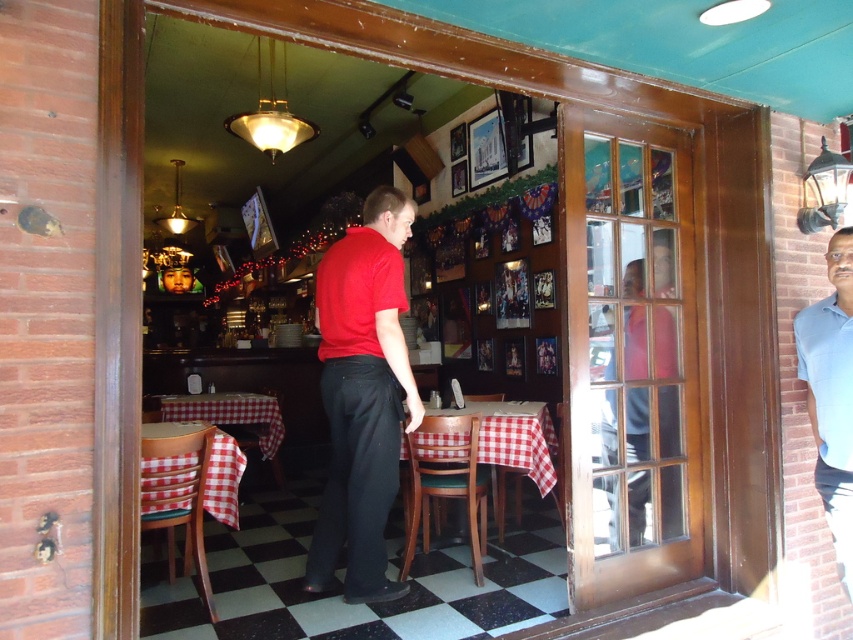
Question: Can you confirm if red matte shirt at center is wider than red checkered fabric at lower left?

Choices:
 (A) no
 (B) yes

Answer: (A)

Question: Does light blue cotton shirt at right appear on the right side of checkered fabric table at center?

Choices:
 (A) no
 (B) yes

Answer: (B)

Question: Which point is farther to the camera?

Choices:
 (A) matte red shirt at right
 (B) checkered fabric table at center
 (C) blue cotton shirt at right

Answer: (B)

Question: Which of the following is the farthest from the observer?

Choices:
 (A) (608, 371)
 (B) (351, 388)
 (C) (480, 429)

Answer: (C)

Question: Considering the real-world distances, which object is closest to the checkered fabric table at center?

Choices:
 (A) red matte shirt at center
 (B) matte red shirt at right

Answer: (A)

Question: In this image, where is light blue cotton shirt at right located relative to red checkered tablecloth at center?

Choices:
 (A) below
 (B) above

Answer: (B)